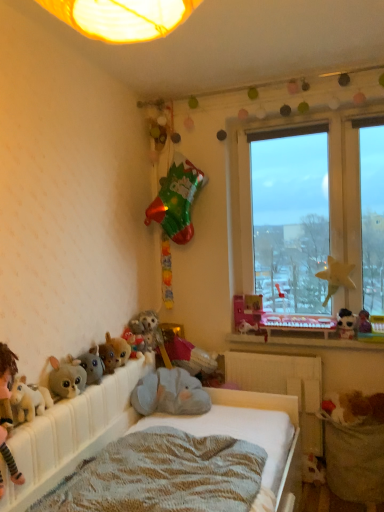
Locate an element on the screen. This screenshot has height=512, width=384. empty space that is ontop of wooden at lower right is located at coordinates (308, 336).